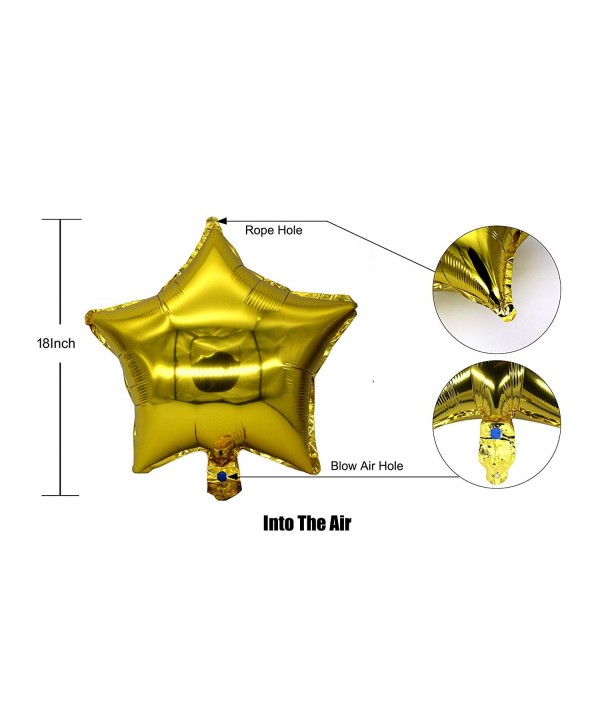
You are a GUI agent. You are given a task and a screenshot of the screen. Output one action in this format:
    pyautogui.click(x=<x>, y=<y>)
    Task: Click on the gold inflated star shaped foil balloon
    The image size is (600, 720).
    Given the screenshot: What is the action you would take?
    pyautogui.click(x=215, y=368)